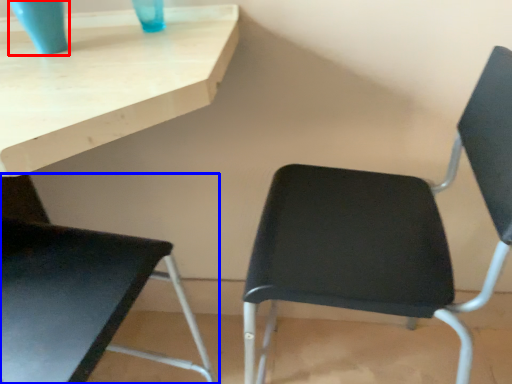
Question: Which object is further to the camera taking this photo, glass vase (highlighted by a red box) or chair (highlighted by a blue box)?

Choices:
 (A) glass vase
 (B) chair

Answer: (A)